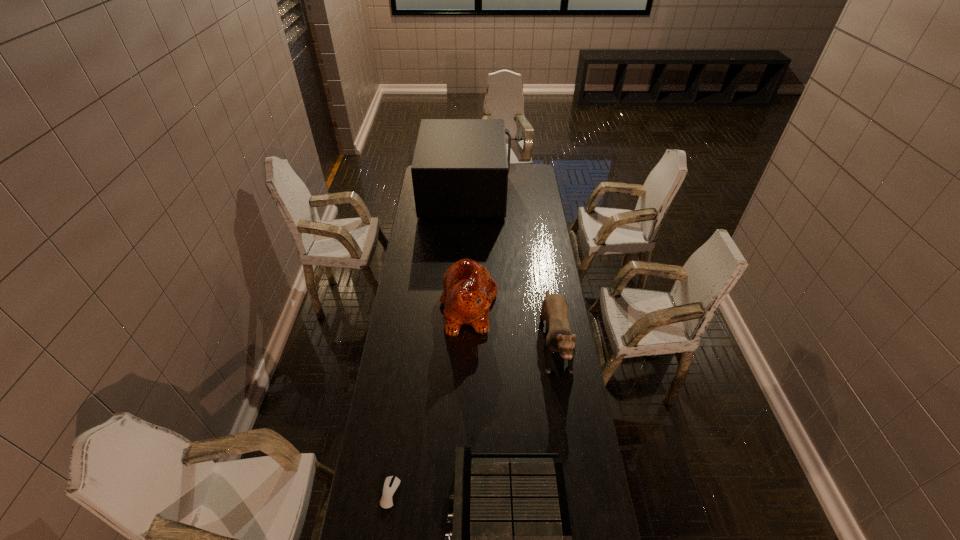
Where is `free space that is in between the cat and the ferret`? free space that is in between the cat and the ferret is located at coordinates (512, 320).

This screenshot has width=960, height=540. In order to click on free space that is in between the microwave oven and the ferret in this screenshot , I will do `click(510, 264)`.

You are a GUI agent. You are given a task and a screenshot of the screen. Output one action in this format:
    pyautogui.click(x=<x>, y=<y>)
    Task: Click on the unoccupied area between the tallest object and the mouse
    
    Given the screenshot: What is the action you would take?
    pyautogui.click(x=428, y=342)

Point out which object is positioned as the third nearest to the cat. Please provide its 2D coordinates. Your answer should be formatted as a tuple, i.e. [(x, y)], where the tuple contains the x and y coordinates of a point satisfying the conditions above.

[(511, 539)]

Identify which object is the fourth closest to the shortest object. Please provide its 2D coordinates. Your answer should be formatted as a tuple, i.e. [(x, y)], where the tuple contains the x and y coordinates of a point satisfying the conditions above.

[(460, 168)]